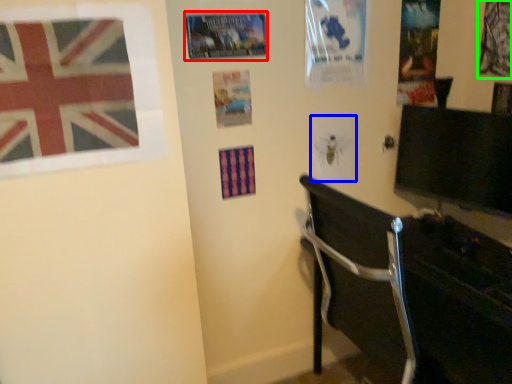
Question: Estimate the real-world distances between objects in this image. Which object is closer to poster page (highlighted by a red box), poster page (highlighted by a blue box) or poster page (highlighted by a green box)?

Choices:
 (A) poster page
 (B) poster page

Answer: (A)